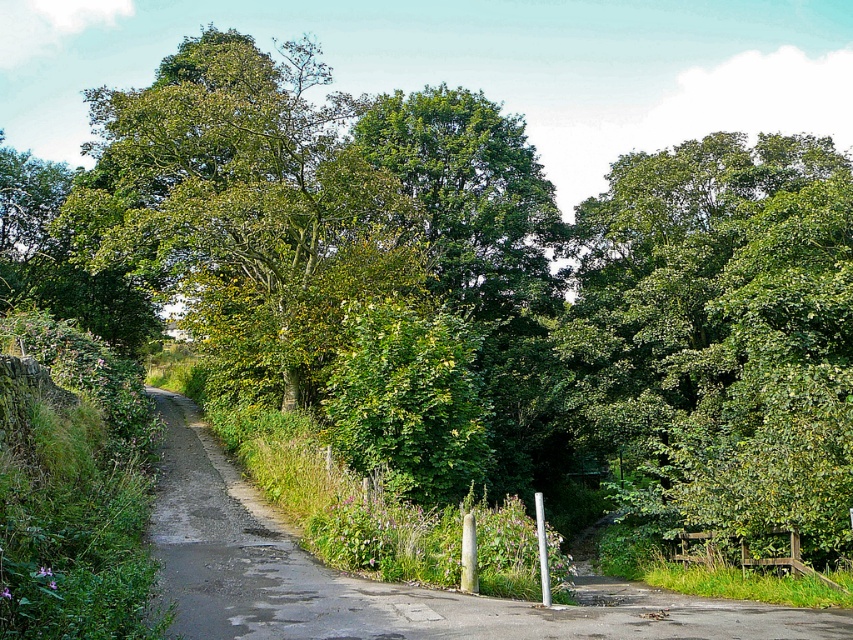
Who is taller, green leafy tree at center or green leafy hedge at center?

green leafy tree at center is taller.

Which is behind, point (213, 152) or point (486, 632)?

Point (213, 152)

I want to click on green leafy tree at center, so click(x=244, y=205).

Does green leafy tree at upper right appear under green leafy hedge at center?

No.

Between green leafy tree at upper right and green leafy hedge at center, which one has more height?

green leafy tree at upper right

Does point (631, 476) lie in front of point (178, 596)?

That is False.

Identify the location of green leafy tree at upper right. This screenshot has height=640, width=853. (720, 336).

Can you confirm if green leafy tree at upper right is bigger than green leafy tree at center?

Incorrect, green leafy tree at upper right is not larger than green leafy tree at center.

Based on the photo, which of these two, green leafy tree at upper right or green leafy tree at center, stands taller?

With more height is green leafy tree at center.

Who is more forward, (822, 326) or (343, 230)?

Point (822, 326)

Where is `green leafy tree at upper right`? The height and width of the screenshot is (640, 853). green leafy tree at upper right is located at coordinates (720, 336).